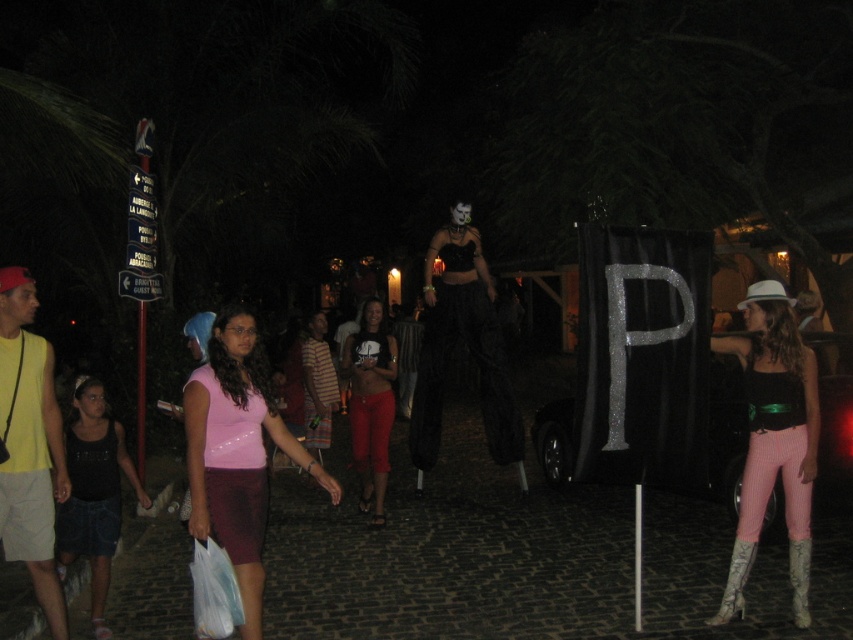
Question: Is pink satin dress at lower left above striped fabric shirt at center?

Choices:
 (A) no
 (B) yes

Answer: (A)

Question: Does pink ribbed pants at center appear under matte pink pants at center?

Choices:
 (A) yes
 (B) no

Answer: (A)

Question: Estimate the real-world distances between objects in this image. Which object is closer to the denim skirt at lower left?

Choices:
 (A) matte pink pants at center
 (B) black matte dress at center
 (C) white leather boot at lower right
 (D) pink satin dress at lower left

Answer: (D)

Question: Which object appears closest to the camera in this image?

Choices:
 (A) pink ribbed pants at center
 (B) black matte dress at center
 (C) pink satin dress at lower left
 (D) striped fabric shirt at center

Answer: (C)

Question: Does pink ribbed pants at center have a lesser width compared to leather high-heeled boot at lower right?

Choices:
 (A) no
 (B) yes

Answer: (A)

Question: Which of the following is the farthest from the observer?

Choices:
 (A) pink satin dress at lower left
 (B) white leather boot at lower right

Answer: (B)